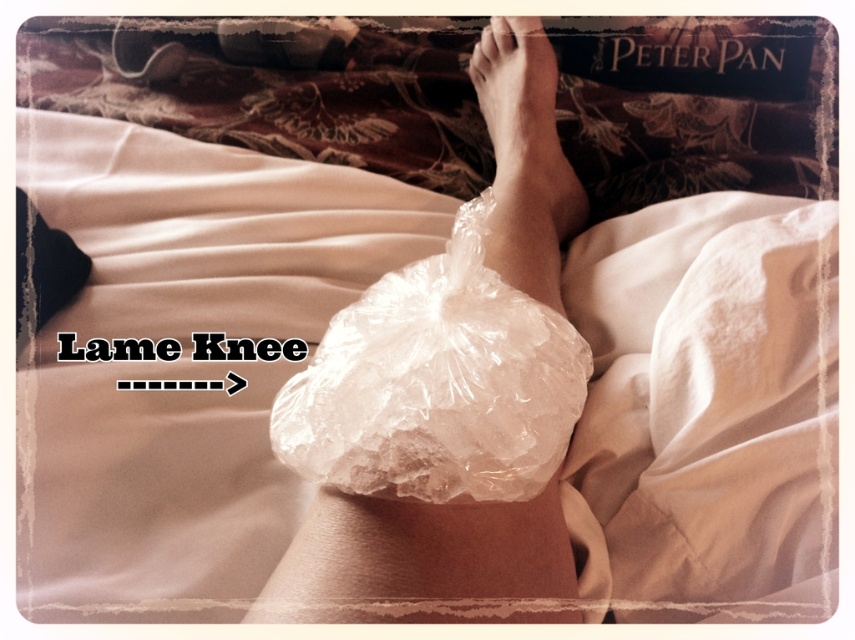
Question: Which of the following is the farthest from the observer?

Choices:
 (A) translucent plastic bag at center
 (B) smooth skin foot at upper center
 (C) clear plastic ice pack at center

Answer: (B)

Question: Which object is the closest to the smooth skin foot at upper center?

Choices:
 (A) translucent plastic bag at center
 (B) clear plastic ice pack at center

Answer: (B)

Question: Can you confirm if translucent plastic bag at center is positioned below smooth skin foot at upper center?

Choices:
 (A) yes
 (B) no

Answer: (A)

Question: Can you confirm if translucent plastic bag at center is thinner than smooth skin foot at upper center?

Choices:
 (A) yes
 (B) no

Answer: (B)

Question: Does clear plastic ice pack at center lie behind smooth skin foot at upper center?

Choices:
 (A) no
 (B) yes

Answer: (A)

Question: Which object appears farthest from the camera in this image?

Choices:
 (A) smooth skin foot at upper center
 (B) translucent plastic bag at center

Answer: (A)